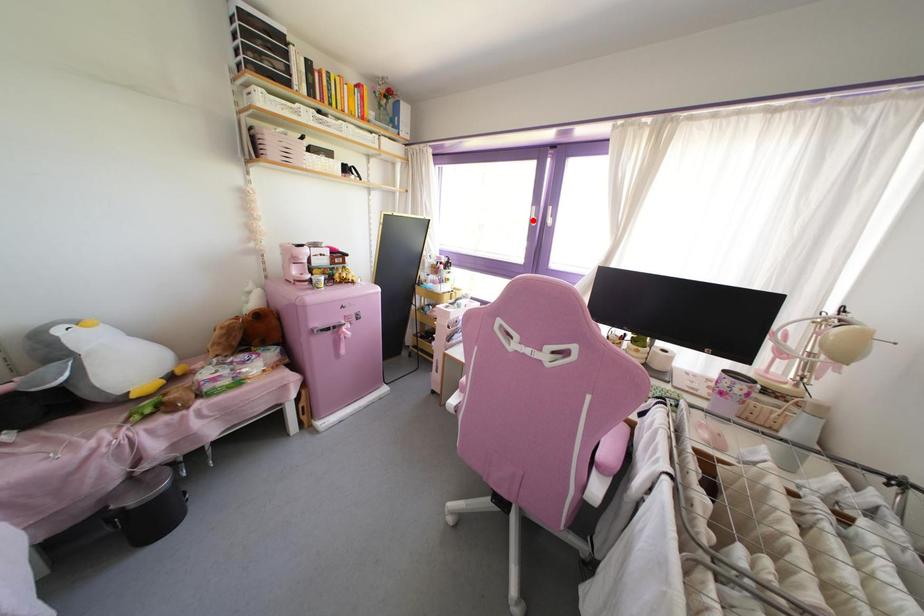
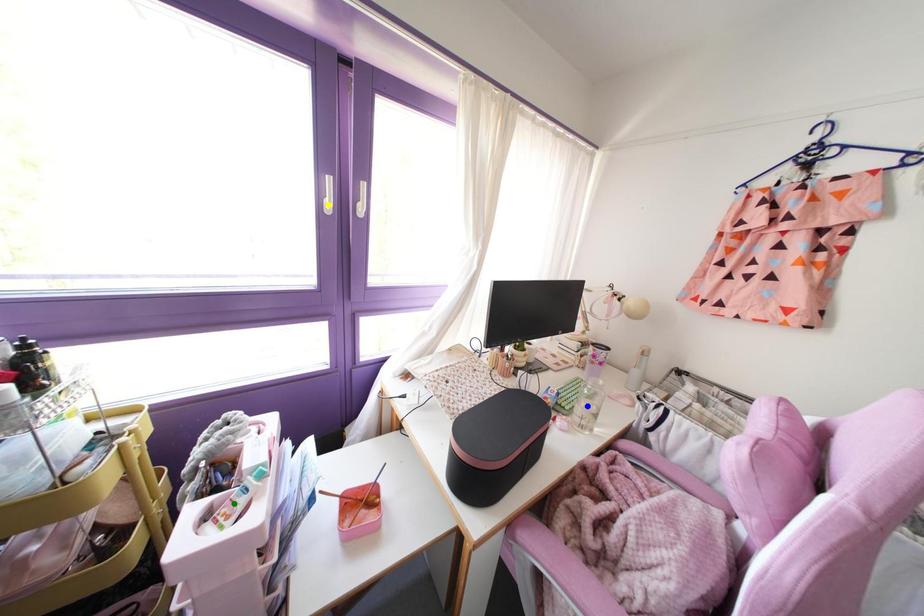
Question: I am providing you with two images of the same scene from different viewpoints. A red point is marked on the first image. You are given multiple points on the second image. Which mark in image 2 goes with the point in image 1?

Choices:
 (A) yellow point
 (B) green point
 (C) blue point

Answer: (A)